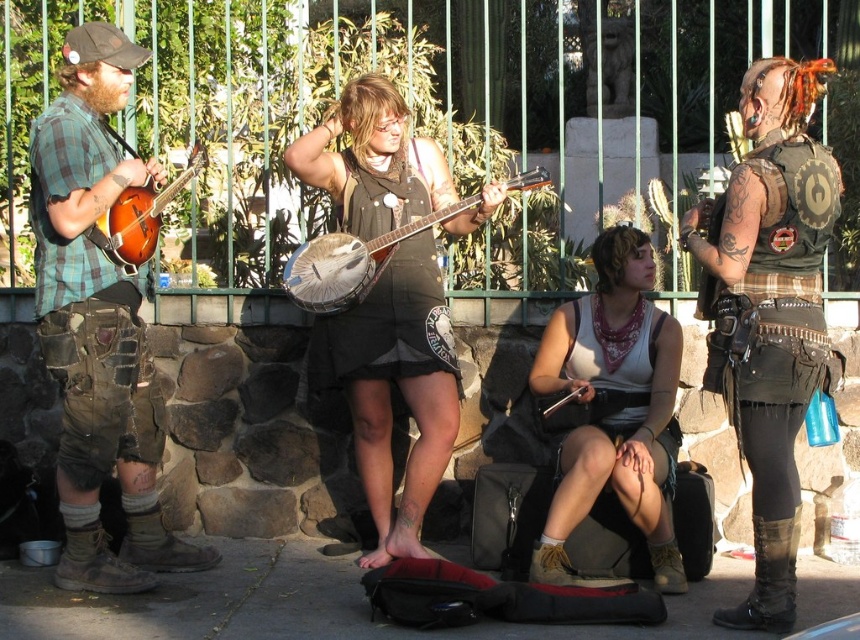
You are standing in front of the metal fence and want to throw a small ball to someone behind the fence. The ball must pass between the two points, point (139, 385) and point (146, 596). Which point should you aim for to ensure the ball passes closest to the fence?

You should aim for point (139, 385) because it is closer to the fence than point (146, 596).

You are a fashion designer observing the performers. You notice the steampunk leather vest at center and the white fabric tank top at center. Which clothing item is visible on top?

The steampunk leather vest at center is positioned over the white fabric tank top at center, making it visible on top.

You are a photographer standing at the edge of the street, aiming to capture the entire scene in one shot. Given that your camera has a fixed focal length, which object between the matte plaid shirt at left and the smooth concrete pavement at lower center should you prioritize framing first to ensure both are visible?

The matte plaid shirt at left might be wider than smooth concrete pavement at lower center, so you should prioritize framing the matte plaid shirt at left first to ensure both fit within the camera frame.